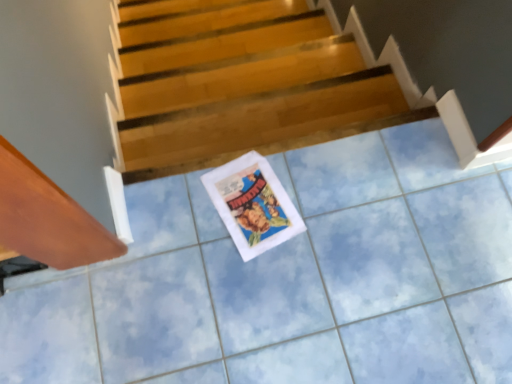
Question: From the image's perspective, does wooden stairs at center appear higher than white paper comic book at center?

Choices:
 (A) no
 (B) yes

Answer: (B)

Question: Is wooden stairs at center facing towards white paper comic book at center?

Choices:
 (A) yes
 (B) no

Answer: (B)

Question: Does wooden stairs at center have a larger size compared to white paper comic book at center?

Choices:
 (A) yes
 (B) no

Answer: (A)

Question: From a real-world perspective, does wooden stairs at center sit lower than white paper comic book at center?

Choices:
 (A) no
 (B) yes

Answer: (B)

Question: Does wooden stairs at center have a greater width compared to white paper comic book at center?

Choices:
 (A) yes
 (B) no

Answer: (B)

Question: Can you confirm if wooden stairs at center is shorter than white paper comic book at center?

Choices:
 (A) yes
 (B) no

Answer: (B)

Question: Does white paper comic book at center turn towards wooden stairs at center?

Choices:
 (A) no
 (B) yes

Answer: (A)

Question: Does white paper comic book at center lie behind wooden stairs at center?

Choices:
 (A) no
 (B) yes

Answer: (A)

Question: Is white paper comic book at center shorter than wooden stairs at center?

Choices:
 (A) yes
 (B) no

Answer: (A)

Question: From a real-world perspective, does white paper comic book at center stand above wooden stairs at center?

Choices:
 (A) no
 (B) yes

Answer: (B)

Question: Is white paper comic book at center closer to the viewer compared to wooden stairs at center?

Choices:
 (A) yes
 (B) no

Answer: (A)

Question: Is white paper comic book at center bigger than wooden stairs at center?

Choices:
 (A) yes
 (B) no

Answer: (B)

Question: In terms of width, does wooden stairs at center look wider or thinner when compared to white paper comic book at center?

Choices:
 (A) thin
 (B) wide

Answer: (A)